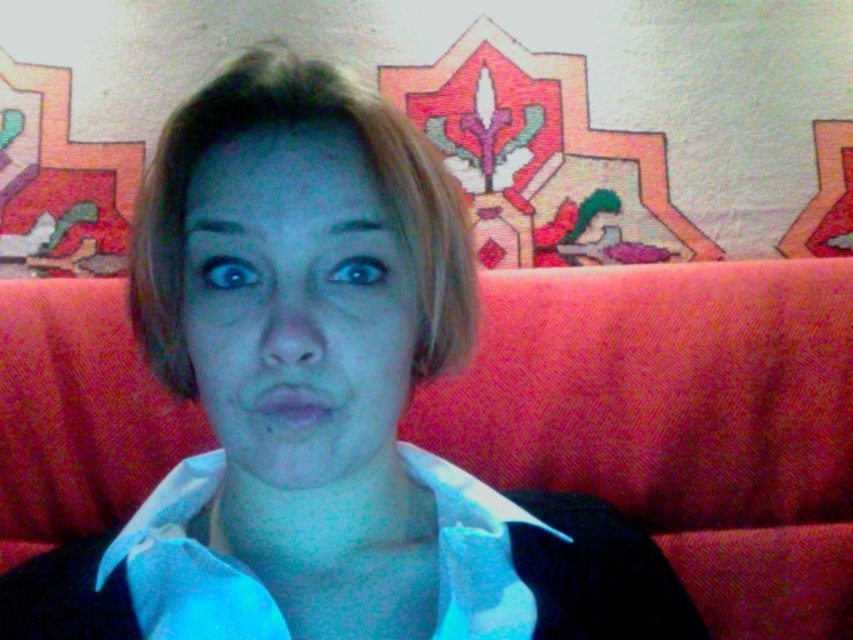
Question: Can you confirm if white cotton shirt at center is positioned below matte pink lips at center?

Choices:
 (A) no
 (B) yes

Answer: (B)

Question: Among these points, which one is nearest to the camera?

Choices:
 (A) [477, 602]
 (B) [221, 147]

Answer: (B)

Question: Where is matte skin face at center located in relation to white cotton shirt at center in the image?

Choices:
 (A) right
 (B) left

Answer: (B)

Question: Which object is farther from the camera taking this photo?

Choices:
 (A) matte skin face at center
 (B) white cotton shirt at center

Answer: (B)

Question: Which object is positioned closest to the matte skin face at center?

Choices:
 (A) white cotton shirt at center
 (B) matte pink lips at center

Answer: (B)

Question: Can you confirm if matte skin face at center is positioned to the left of white cotton shirt at center?

Choices:
 (A) no
 (B) yes

Answer: (B)